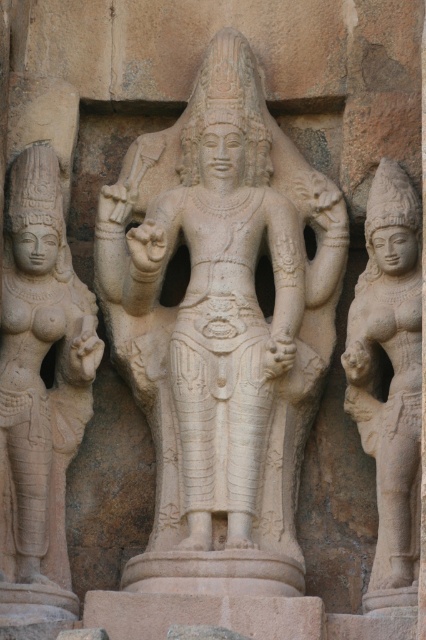
Question: Is beige stone statue at left thinner than beige stone statue at right?

Choices:
 (A) no
 (B) yes

Answer: (A)

Question: Is beige stone statue at left smaller than beige stone statue at right?

Choices:
 (A) yes
 (B) no

Answer: (A)

Question: Among these points, which one is farthest from the camera?

Choices:
 (A) (221, 397)
 (B) (391, 380)
 (C) (55, 280)

Answer: (C)

Question: Which of these objects is positioned farthest from the white stone statue at center?

Choices:
 (A) beige stone statue at right
 (B) beige stone statue at left

Answer: (B)

Question: Which point appears farthest from the camera in this image?

Choices:
 (A) (68, 278)
 (B) (258, 211)

Answer: (B)

Question: Is beige stone statue at left below beige stone statue at right?

Choices:
 (A) yes
 (B) no

Answer: (B)